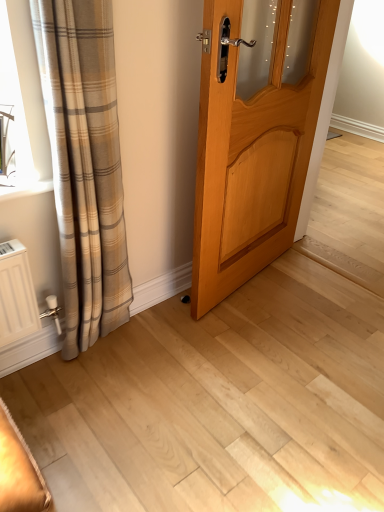
Locate an element on the screen. free point below light wood door at center (from a real-world perspective) is located at coordinates click(x=258, y=280).